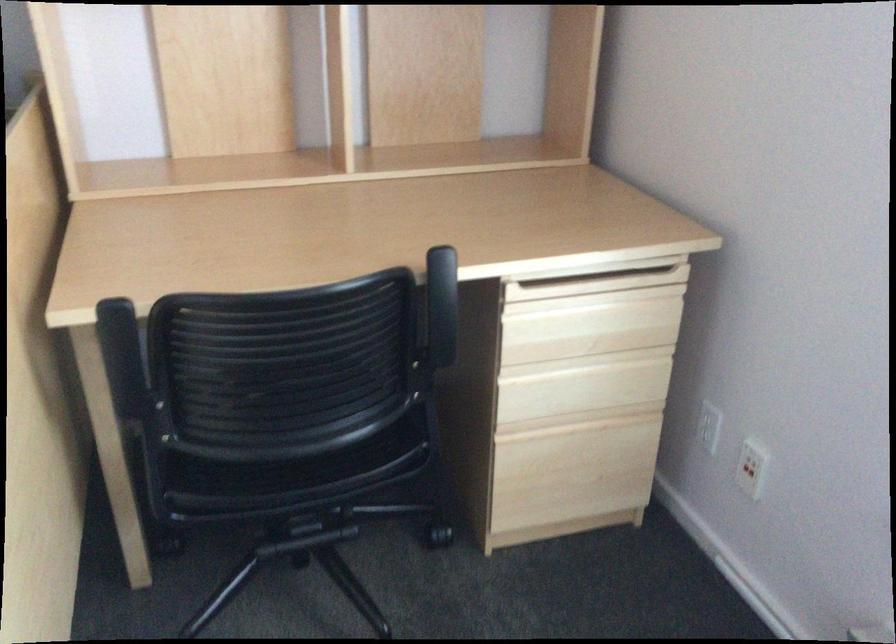
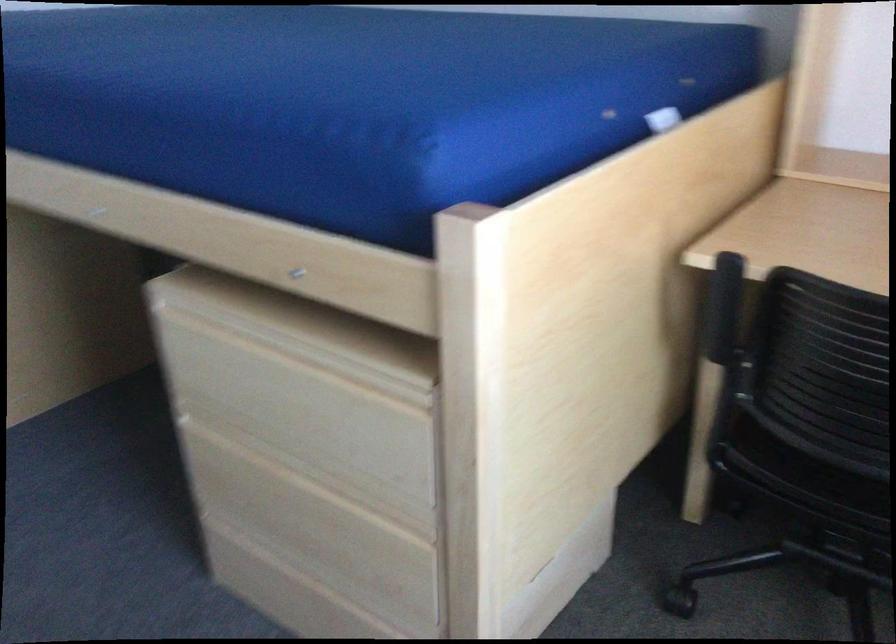
Question: The first image is from the beginning of the video and the second image is from the end. How did the camera likely rotate when shooting the video?

Choices:
 (A) Left
 (B) Right
 (C) Up
 (D) Down

Answer: (A)